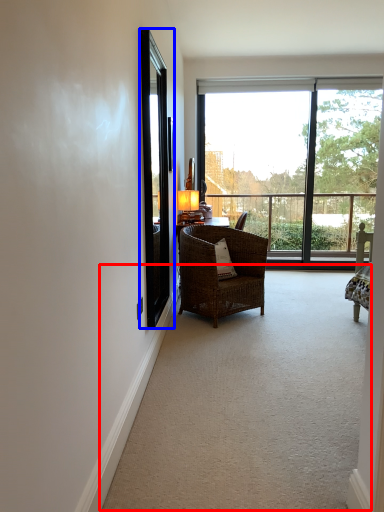
Question: Among these objects, which one is nearest to the camera, corridor (highlighted by a red box) or screen door (highlighted by a blue box)?

Choices:
 (A) corridor
 (B) screen door

Answer: (A)